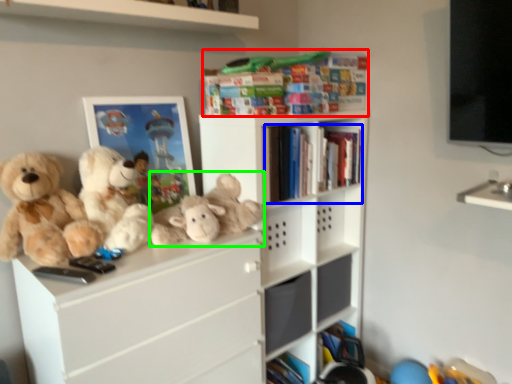
Question: Which object is positioned farthest from book (highlighted by a red box)? Select from book (highlighted by a blue box) and toy (highlighted by a green box).

Choices:
 (A) book
 (B) toy

Answer: (B)